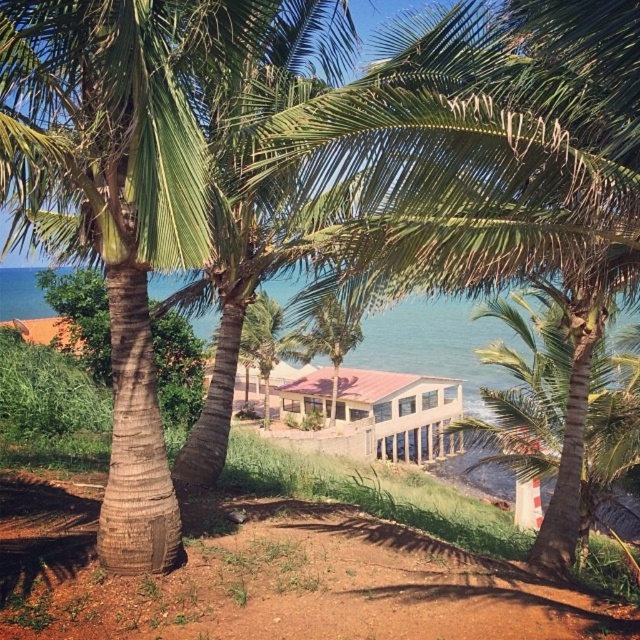
You are a photographer planning to capture a sunset shot where both the green leafy palm tree at center and the pink corrugated metal hut at center are visible. Based on their heights, which object will likely cast a longer shadow?

The green leafy palm tree at center will cast a longer shadow because it has a greater height compared to the pink corrugated metal hut at center.